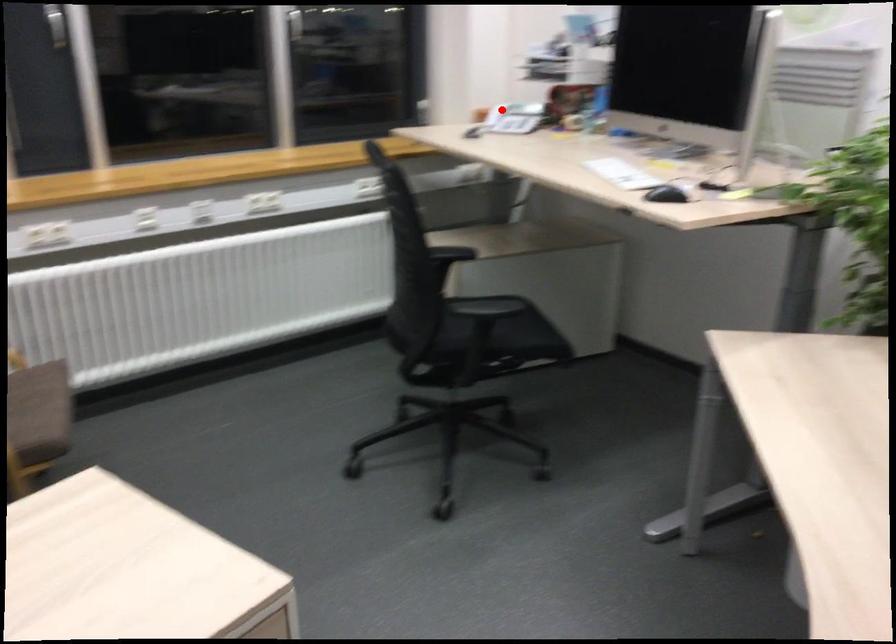
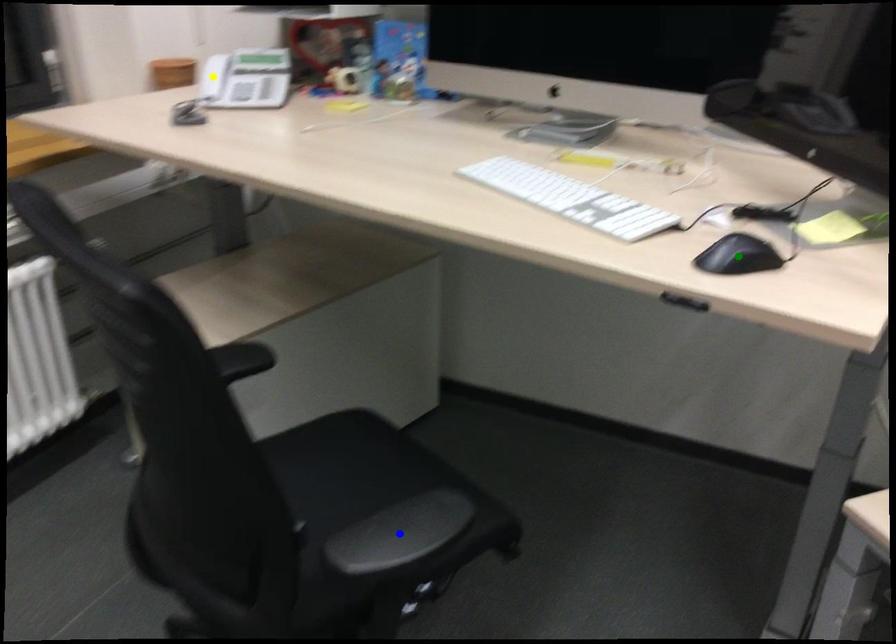
Question: I am providing you with two images of the same scene from different viewpoints. A red point is marked on the first image. You are given multiple points on the second image. Which spot in image 2 lines up with the point in image 1?

Choices:
 (A) yellow point
 (B) blue point
 (C) green point

Answer: (A)